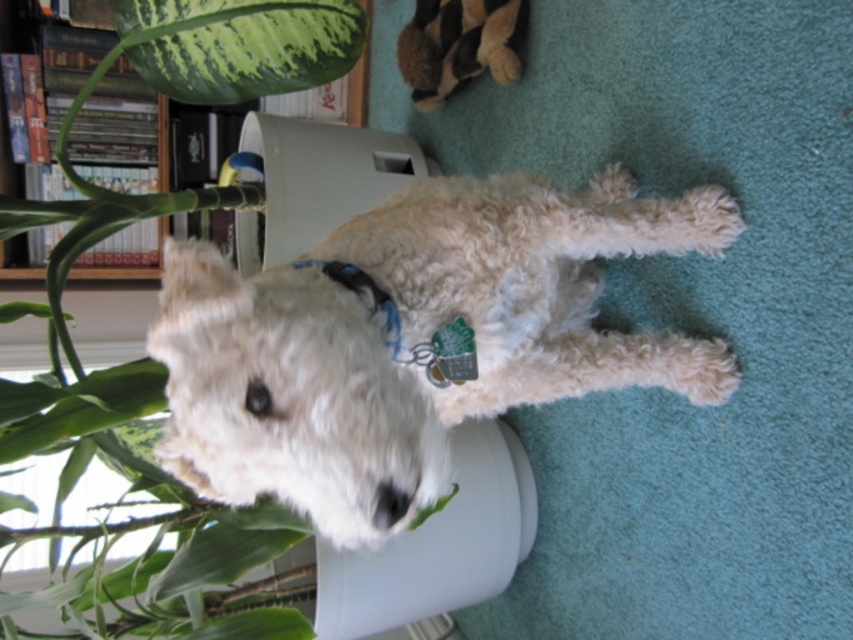
You are a photographer trying to capture a clear photo of the white fluffy dog at center and the soft plush toy at upper center. Which object will appear larger in the photo?

The white fluffy dog at center will appear larger in the photo because it is closer to the viewer than the soft plush toy at upper center.

In the scene shown: You are standing in the room and see two points marked in the image. Which point is closer to you, point (492, 33) or point (389, 328)?

Point (492, 33) is closer to you because it is further to the viewer than point (389, 328).

You are an interior designer planning to place a new sofa in the living room where the white fluffy dog at center and the wooden bookshelf at upper left are located. Given their sizes, which object would require more space in the room?

The white fluffy dog at center requires more space in the room because it is larger in size than the wooden bookshelf at upper left.